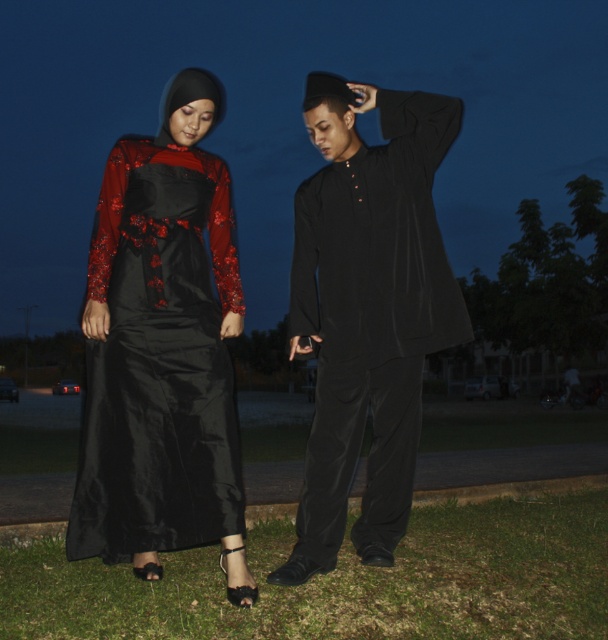
Question: Which of the following is the farthest from the observer?

Choices:
 (A) (418, 305)
 (B) (67, 556)

Answer: (A)

Question: Is matte black kurti at center thinner than shiny black dress at left?

Choices:
 (A) no
 (B) yes

Answer: (A)

Question: Considering the relative positions of matte black kurti at center and green grass at lower center in the image provided, where is matte black kurti at center located with respect to green grass at lower center?

Choices:
 (A) right
 (B) left

Answer: (B)

Question: Which object appears closest to the camera in this image?

Choices:
 (A) shiny satin dress at center
 (B) green grass at lower center
 (C) shiny black dress at left
 (D) matte black kurti at center

Answer: (B)

Question: Can you confirm if shiny satin dress at center is bigger than matte black kurti at center?

Choices:
 (A) no
 (B) yes

Answer: (A)

Question: Which of these objects is positioned farthest from the matte black kurti at center?

Choices:
 (A) green grass at lower center
 (B) shiny black dress at left
 (C) shiny satin dress at center

Answer: (A)